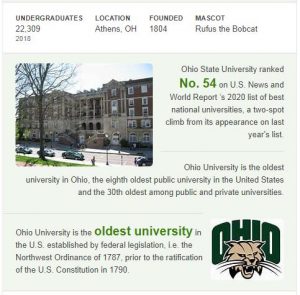
Identify the location of archway. (98, 127), (91, 127), (83, 126).